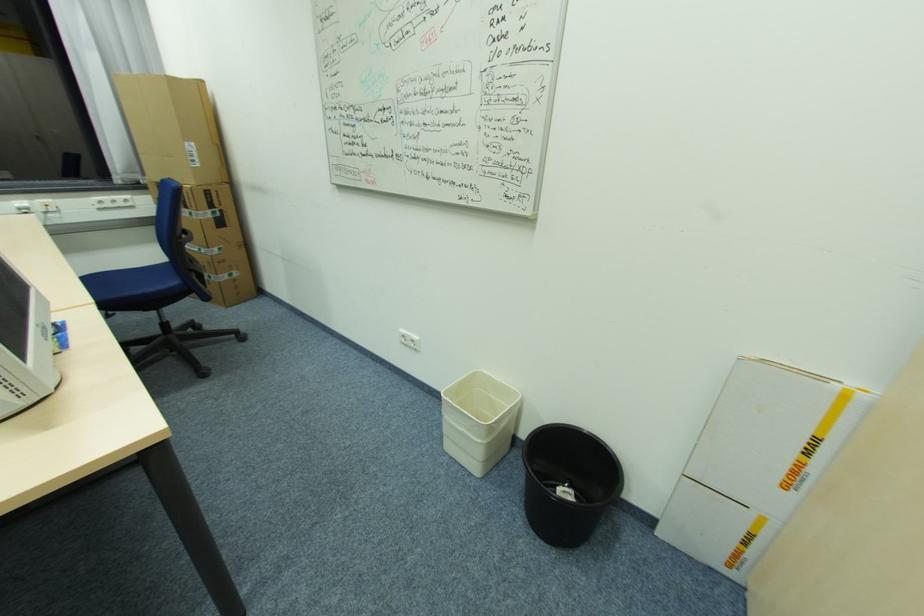
Which object does [716,533] point to?

This point indicates the lower cardboard box.